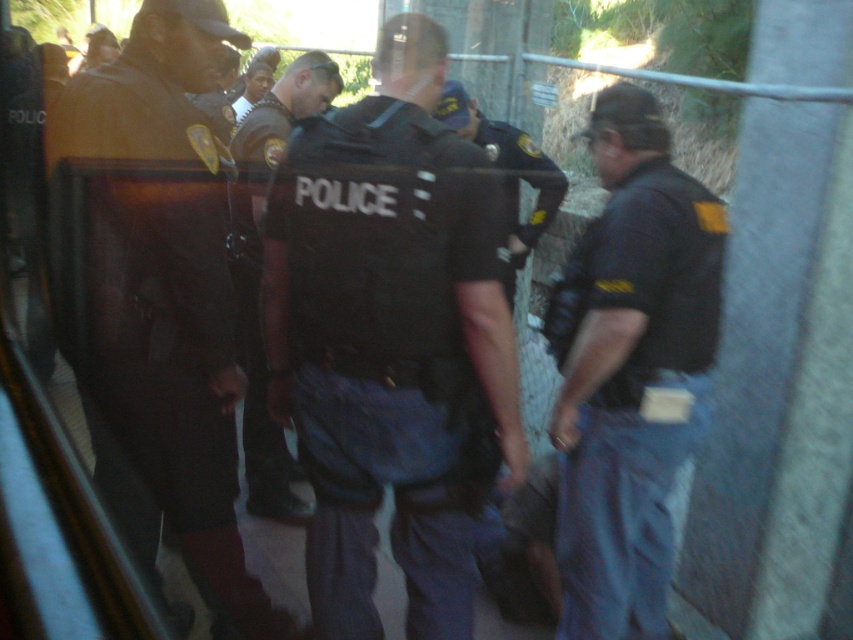
Question: Which of the following is the farthest from the observer?

Choices:
 (A) (242, 172)
 (B) (201, 492)
 (C) (265, 86)

Answer: (C)

Question: Is black matte police vest at center further to the viewer compared to dark brown leather jacket at left?

Choices:
 (A) no
 (B) yes

Answer: (A)

Question: Which object is positioned farthest from the dark blue uniform at center?

Choices:
 (A) smooth skin face at center
 (B) black matte police vest at center
 (C) black uniform at center
 (D) dark brown leather jacket at left

Answer: (A)

Question: Is black matte police vest at center behind black uniform at center?

Choices:
 (A) yes
 (B) no

Answer: (B)

Question: Considering the real-world distances, which object is closest to the black uniform at center?

Choices:
 (A) dark brown leather jacket at left
 (B) black matte police vest at center
 (C) dark blue uniform at center
 (D) smooth skin face at center

Answer: (A)

Question: In this image, where is black matte police vest at center located relative to dark brown leather jacket at left?

Choices:
 (A) below
 (B) above

Answer: (B)